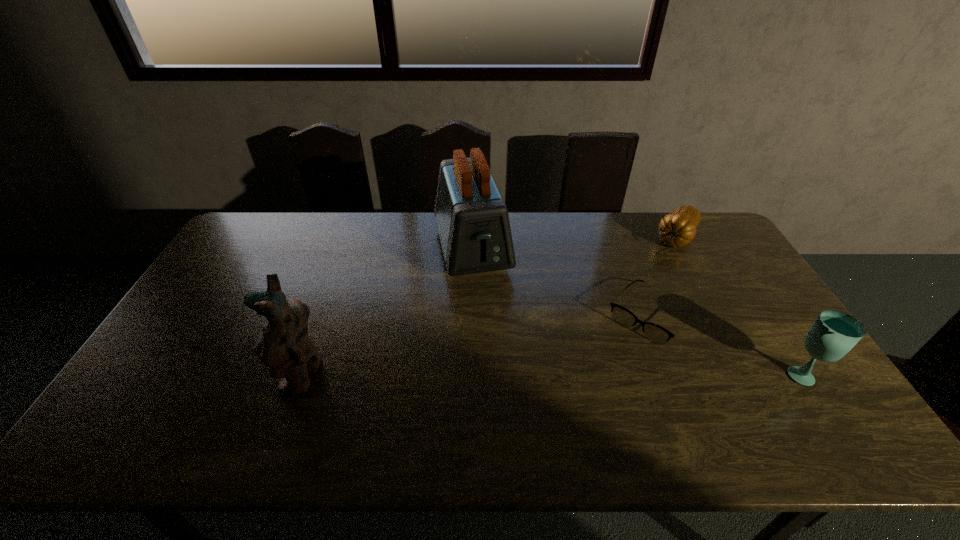
The width and height of the screenshot is (960, 540). What are the coordinates of `free point located 0.180m on the face of the shortest object` in the screenshot? It's located at (596, 383).

This screenshot has width=960, height=540. I want to click on vacant space situated on the face of the shortest object, so click(x=621, y=353).

You are a GUI agent. You are given a task and a screenshot of the screen. Output one action in this format:
    pyautogui.click(x=<x>, y=<y>)
    Task: Click on the vacant region located on the face of the shortest object
    The image size is (960, 540).
    Given the screenshot: What is the action you would take?
    pyautogui.click(x=607, y=371)

This screenshot has height=540, width=960. Find the location of `free space located 0.120m on the front-facing side of the toaster`. free space located 0.120m on the front-facing side of the toaster is located at coordinates (489, 315).

In order to click on vacant region located 0.190m on the front-facing side of the toaster in this screenshot , I will do `click(493, 333)`.

This screenshot has width=960, height=540. Identify the location of vacant space situated 0.080m on the front-facing side of the toaster. (486, 305).

This screenshot has width=960, height=540. I want to click on vacant space located 0.350m on the stem side of the gourd, so click(x=629, y=310).

Where is `vacant space situated 0.190m on the stem side of the gourd`? The height and width of the screenshot is (540, 960). vacant space situated 0.190m on the stem side of the gourd is located at coordinates (649, 281).

Where is `free spot located on the stem side of the gourd`? free spot located on the stem side of the gourd is located at coordinates (643, 290).

This screenshot has height=540, width=960. Identify the location of toaster that is at the far edge. (472, 219).